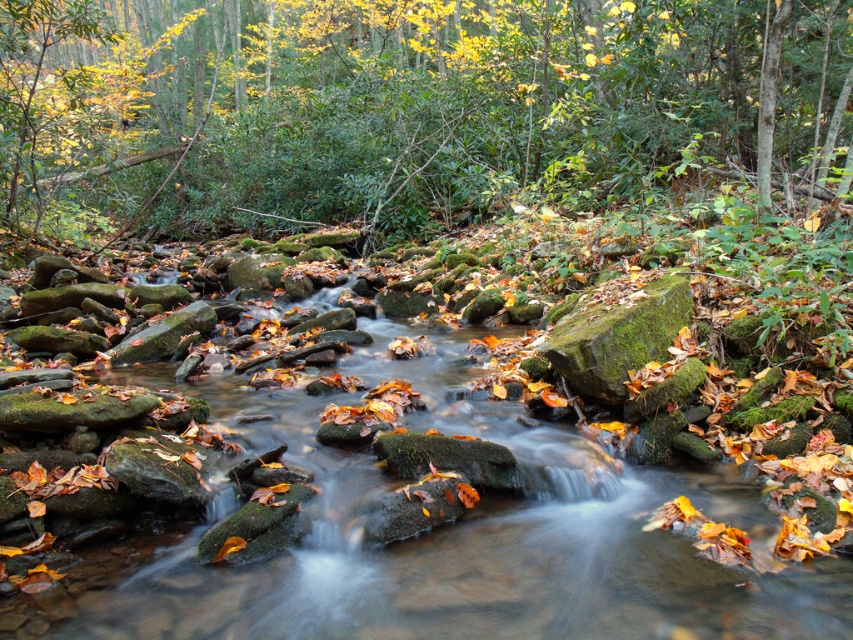
Does green mossy rocks at center appear on the right side of green leafy tree at upper center?

Correct, you'll find green mossy rocks at center to the right of green leafy tree at upper center.

Which is in front, point (691, 552) or point (576, 76)?

Point (691, 552)

Find the location of a particular element. green mossy rocks at center is located at coordinates (405, 484).